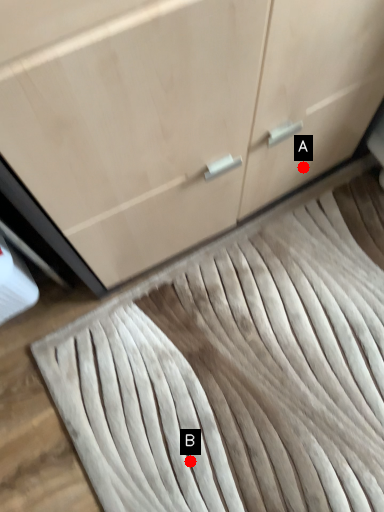
Question: Two points are circled on the image, labeled by A and B beside each circle. Which point is closer to the camera?

Choices:
 (A) A is closer
 (B) B is closer

Answer: (B)